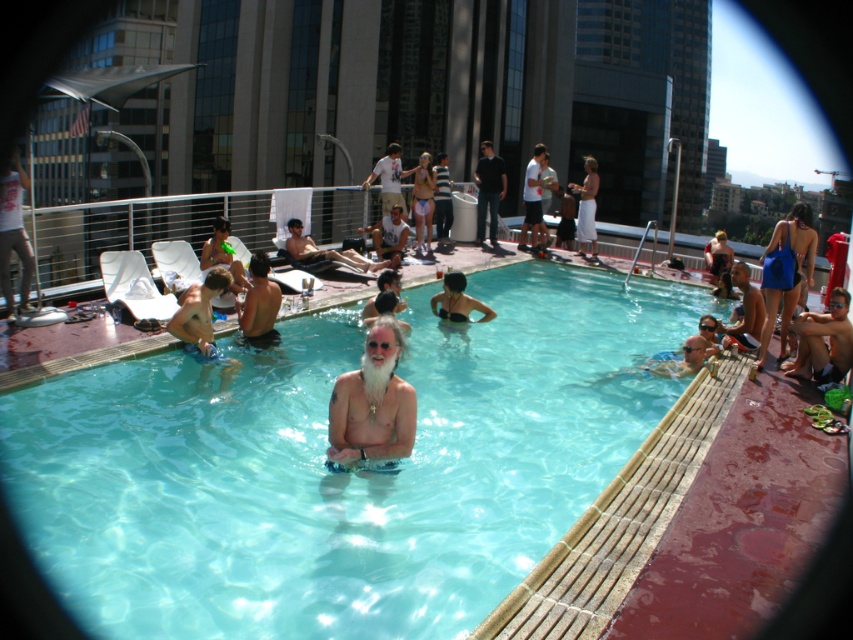
You are standing at the point with coordinates point (384,184) and want to walk towards the point with coordinates point (590,243). Is there a clear path between these two points?

Yes, there is a clear path between point (384,184) and point (590,243) because the description states that point (590,243) is behind point (384,184), implying they are aligned along a straight line without obstructions.

You are standing at the center of the rooftop pool. You want to find the white cotton shorts at upper right. Which direction should you look to see the point at [585,205]?

The point at [585,205] is located on the white cotton shorts at upper right. Since the coordinate system is normalized, the upper right corner is at 1,1 and lower left is at 0,0. The x coordinate 0.323 is closer to the left side and the y coordinate 0.688 is closer to the top. Therefore, you should look to the upper left direction to see the point at [585,205].